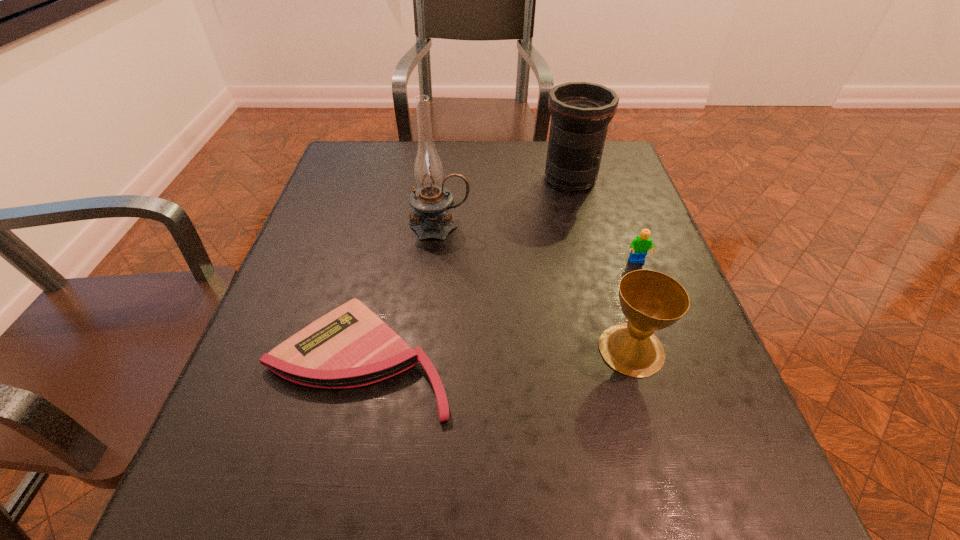
You are a GUI agent. You are given a task and a screenshot of the screen. Output one action in this format:
    pyautogui.click(x=<x>, y=<y>)
    Task: Click on the vacant space at the near edge of the desktop
    Image resolution: width=960 pixels, height=540 pixels.
    Given the screenshot: What is the action you would take?
    pyautogui.click(x=505, y=527)

This screenshot has width=960, height=540. In the image, there is a desktop. Find the location of `vacant space at the left edge`. vacant space at the left edge is located at coordinates (316, 406).

At what (x,y) coordinates should I click in order to perform the action: click on free spot at the right edge of the desktop. Please return your answer as a coordinate pair (x, y). The width and height of the screenshot is (960, 540). Looking at the image, I should click on (644, 218).

The image size is (960, 540). Find the location of `free region at the far right corner`. free region at the far right corner is located at coordinates (608, 146).

I want to click on vacant space that's between the farthest object and the tallest object, so click(x=505, y=203).

Image resolution: width=960 pixels, height=540 pixels. What are the coordinates of `free space between the farthest object and the Lego` in the screenshot? It's located at (604, 220).

The image size is (960, 540). In order to click on free spot between the wristlet and the third farthest object in this screenshot , I will do `click(498, 311)`.

This screenshot has height=540, width=960. I want to click on vacant space that's between the fourth nearest object and the telephoto lens, so click(505, 203).

Locate an element on the screen. free spot between the oil lamp and the chalice is located at coordinates (536, 288).

Identify the location of free spot between the telephoto lens and the Lego. (604, 220).